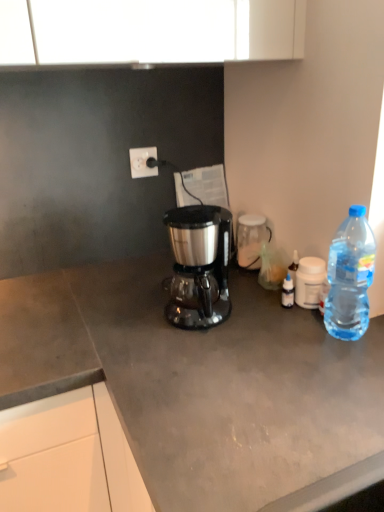
At what (x,y) coordinates should I click in order to perform the action: click on free location in front of transparent glass jar at center, which is the second coffee cup from right to left. Please return your answer as a coordinate pair (x, y). Looking at the image, I should click on (247, 288).